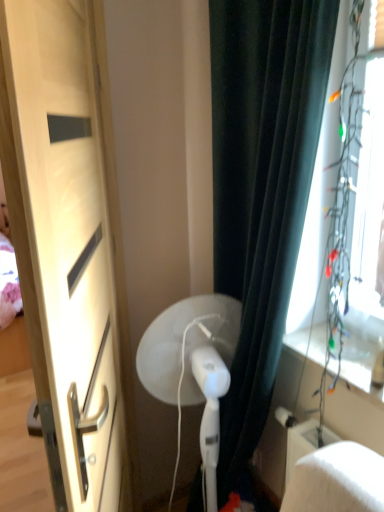
Question: From a real-world perspective, is white plastic fan at center positioned above or below matte wood door at left?

Choices:
 (A) above
 (B) below

Answer: (B)

Question: From the image's perspective, is white plastic fan at center positioned above or below matte wood door at left?

Choices:
 (A) above
 (B) below

Answer: (B)

Question: Estimate the real-world distances between objects in this image. Which object is closer to the matte wood door at left?

Choices:
 (A) transparent plastic window screen at right
 (B) white plastic fan at center
 (C) dark green fabric curtain at right

Answer: (B)

Question: Which of these objects is positioned closest to the white plastic fan at center?

Choices:
 (A) dark green fabric curtain at right
 (B) matte wood door at left
 (C) transparent plastic window screen at right

Answer: (A)